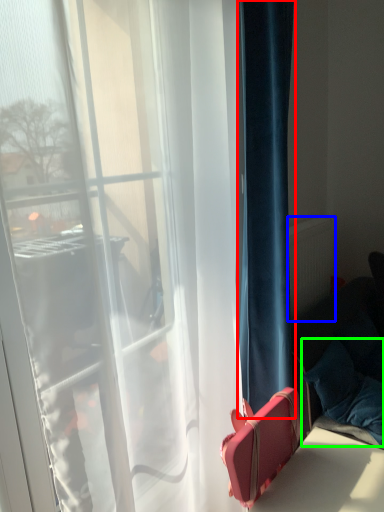
Question: Based on their relative distances, which object is farther from curtain (highlighted by a red box)? Choose from radiator (highlighted by a blue box) and pillow (highlighted by a green box).

Choices:
 (A) radiator
 (B) pillow

Answer: (A)